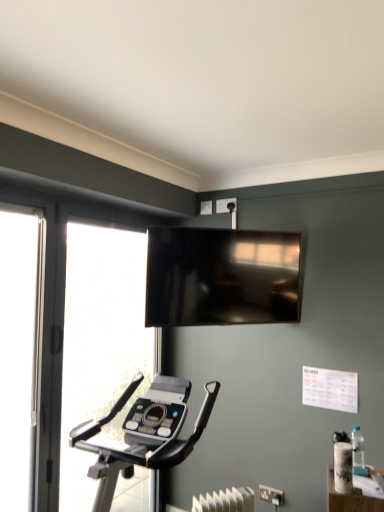
Find the location of `transparent glass window at left`. transparent glass window at left is located at coordinates 100,345.

Measure the distance between white plastic electric outlet at upper center, which is the 2th electric outlet from right to left, and camera.

white plastic electric outlet at upper center, which is the 2th electric outlet from right to left, and camera are 2.74 meters apart.

How much space does white plastic electric outlet at upper center, which appears as the 1th electric outlet when viewed from the top, occupy horizontally?

It is 5.09 centimeters.

Locate an element on the screen. This screenshot has height=512, width=384. white plastic electric outlet at center, acting as the first electric outlet starting from the bottom is located at coordinates (271, 495).

What is the approximate height of matte black tv at upper center?

It is 25.56 inches.

I want to click on transparent glass window at left, so click(x=100, y=345).

Would you say transparent glass window at left is part of matte black tv at upper center's contents?

No.

Is there a large distance between matte black tv at upper center and transparent glass window at left?

No, matte black tv at upper center is not far from transparent glass window at left.

The image size is (384, 512). Find the location of `window in front of the matte black tv at upper center`. window in front of the matte black tv at upper center is located at coordinates (100, 345).

From a real-world perspective, relative to transparent glass window at left, is matte black tv at upper center vertically above or below?

In terms of real-world spatial position, matte black tv at upper center is above transparent glass window at left.

Could you tell me if white plastic electric outlet at center, the second electric outlet viewed from the back, is turned towards white plastic electric outlet at upper center, which appears as the 2th electric outlet when viewed from the front?

No, white plastic electric outlet at center, the second electric outlet viewed from the back, is not facing towards white plastic electric outlet at upper center, which appears as the 2th electric outlet when viewed from the front.

Which object is more forward, white plastic electric outlet at center, the second electric outlet viewed from the back, or white plastic electric outlet at upper center, which appears as the 2th electric outlet when viewed from the front?

Positioned in front is white plastic electric outlet at center, the second electric outlet viewed from the back.

Are white plastic electric outlet at center, which is counted as the second electric outlet, starting from the left, and white plastic electric outlet at upper center, the first electric outlet from the left, beside each other?

No, white plastic electric outlet at center, which is counted as the second electric outlet, starting from the left, is not in contact with white plastic electric outlet at upper center, the first electric outlet from the left.

From the image's perspective, which is below, white plastic electric outlet at center, the first electric outlet positioned from the right, or white plastic electric outlet at upper center, which appears as the 1th electric outlet when viewed from the top?

white plastic electric outlet at center, the first electric outlet positioned from the right, appears lower in the image.

What's the angular difference between transparent glass window at left and matte black tv at upper center's facing directions?

The facing directions of transparent glass window at left and matte black tv at upper center are 41.1 degrees apart.

In the scene shown: From a real-world perspective, which object stands above the other?

In real-world perspective, matte black tv at upper center is above.

Is matte black tv at upper center a part of transparent glass window at left?

No, matte black tv at upper center is located outside of transparent glass window at left.

Which object is wider, matte black tv at upper center or white plastic electric outlet at center, the 2th electric outlet positioned from the top?

Wider between the two is matte black tv at upper center.

Find the location of a particular element. electric outlet lying below the matte black tv at upper center (from the image's perspective) is located at coordinates (271, 495).

Is matte black tv at upper center in contact with white plastic electric outlet at center, the second electric outlet viewed from the back?

No, matte black tv at upper center is not beside white plastic electric outlet at center, the second electric outlet viewed from the back.

From the image's perspective, between matte black tv at upper center and white plastic electric outlet at center, the first electric outlet positioned from the right, who is located below?

white plastic electric outlet at center, the first electric outlet positioned from the right, from the image's perspective.

How many degrees apart are the facing directions of white plastic electric outlet at upper center, positioned as the 1th electric outlet in back-to-front order, and transparent glass screen door at left?

90 degrees.

Is white plastic electric outlet at upper center, positioned as the 1th electric outlet in back-to-front order, further to camera compared to transparent glass screen door at left?

Yes, white plastic electric outlet at upper center, positioned as the 1th electric outlet in back-to-front order, is further from the viewer.

Is white plastic electric outlet at upper center, which appears as the 1th electric outlet when viewed from the top, smaller than transparent glass screen door at left?

Yes.

Is white plastic electric outlet at upper center, the first electric outlet from the left, directly adjacent to transparent glass screen door at left?

They are not placed beside each other.

Can you confirm if white plastic electric outlet at center, the first electric outlet positioned from the right, is thinner than matte black tv at upper center?

Indeed, white plastic electric outlet at center, the first electric outlet positioned from the right, has a lesser width compared to matte black tv at upper center.

Considering the relative sizes of white plastic electric outlet at center, the second electric outlet viewed from the back, and matte black tv at upper center in the image provided, is white plastic electric outlet at center, the second electric outlet viewed from the back, shorter than matte black tv at upper center?

Yes, white plastic electric outlet at center, the second electric outlet viewed from the back, is shorter than matte black tv at upper center.

Is white plastic electric outlet at center, acting as the first electric outlet starting from the bottom, bigger or smaller than matte black tv at upper center?

In the image, white plastic electric outlet at center, acting as the first electric outlet starting from the bottom, appears to be smaller than matte black tv at upper center.

From the image's perspective, relative to matte black tv at upper center, is white plastic electric outlet at center, the first electric outlet positioned from the right, above or below?

From the image's perspective, white plastic electric outlet at center, the first electric outlet positioned from the right, appears below matte black tv at upper center.

From the picture: Which of these two, transparent glass window at left or white plastic electric outlet at upper center, marked as the second electric outlet in a bottom-to-top arrangement, is thinner?

white plastic electric outlet at upper center, marked as the second electric outlet in a bottom-to-top arrangement, is thinner.

Is transparent glass window at left aimed at white plastic electric outlet at upper center, which is the 2th electric outlet from right to left?

Yes, transparent glass window at left is facing white plastic electric outlet at upper center, which is the 2th electric outlet from right to left.

From the image's perspective, is transparent glass window at left above or below white plastic electric outlet at upper center, which appears as the 1th electric outlet when viewed from the top?

transparent glass window at left is below white plastic electric outlet at upper center, which appears as the 1th electric outlet when viewed from the top.

Does transparent glass window at left have a smaller size compared to white plastic electric outlet at upper center, positioned as the 1th electric outlet in back-to-front order?

No.

Where is `television above the transparent glass window at left (from a real-world perspective)`? This screenshot has width=384, height=512. television above the transparent glass window at left (from a real-world perspective) is located at coordinates pyautogui.click(x=221, y=277).

This screenshot has height=512, width=384. In order to click on electric outlet lying on the right of white plastic electric outlet at upper center, marked as the second electric outlet in a bottom-to-top arrangement in this screenshot , I will do 271,495.

When comparing their distances from white plastic electric outlet at center, the 2th electric outlet positioned from the top, does matte black tv at upper center or transparent glass window at left seem closer?

matte black tv at upper center lies closer to white plastic electric outlet at center, the 2th electric outlet positioned from the top, than the other object.

Looking at the image, which one is located further to matte black tv at upper center, transparent glass window at left or transparent glass screen door at left?

transparent glass screen door at left.

Considering their positions, is white plastic electric outlet at upper center, which appears as the 1th electric outlet when viewed from the top, positioned closer to transparent glass window at left than matte black tv at upper center?

The object closer to transparent glass window at left is matte black tv at upper center.

Considering their positions, is matte black tv at upper center positioned closer to transparent glass screen door at left than white plastic electric outlet at upper center, which appears as the 2th electric outlet when viewed from the front?

The object closer to transparent glass screen door at left is matte black tv at upper center.

When comparing their distances from white plastic electric outlet at upper center, which appears as the 2th electric outlet when viewed from the front, does transparent glass window at left or matte black tv at upper center seem further?

Among the two, transparent glass window at left is located further to white plastic electric outlet at upper center, which appears as the 2th electric outlet when viewed from the front.

Based on their spatial positions, is transparent glass screen door at left or white plastic electric outlet at upper center, which is the 2th electric outlet from right to left, closer to white plastic electric outlet at center, the first electric outlet positioned from the right?

transparent glass screen door at left.

From the image, which object appears to be nearer to matte black tv at upper center, transparent glass screen door at left or white plastic electric outlet at center, the second electric outlet viewed from the back?

transparent glass screen door at left.

When comparing their distances from matte black tv at upper center, does white plastic electric outlet at center, the 1th electric outlet from the front, or transparent glass screen door at left seem closer?

Among the two, transparent glass screen door at left is located nearer to matte black tv at upper center.

Where is `screen door between white plastic electric outlet at upper center, marked as the second electric outlet in a bottom-to-top arrangement, and transparent glass window at left vertically`? The height and width of the screenshot is (512, 384). screen door between white plastic electric outlet at upper center, marked as the second electric outlet in a bottom-to-top arrangement, and transparent glass window at left vertically is located at coordinates (20, 354).

Where is `television between white plastic electric outlet at upper center, the first electric outlet from the left, and white plastic electric outlet at center, the 2th electric outlet positioned from the top, vertically`? television between white plastic electric outlet at upper center, the first electric outlet from the left, and white plastic electric outlet at center, the 2th electric outlet positioned from the top, vertically is located at coordinates (221, 277).

Where is `television between white plastic electric outlet at upper center, which appears as the 1th electric outlet when viewed from the top, and transparent glass window at left from top to bottom`? television between white plastic electric outlet at upper center, which appears as the 1th electric outlet when viewed from the top, and transparent glass window at left from top to bottom is located at coordinates (221, 277).

The height and width of the screenshot is (512, 384). I want to click on window that lies between white plastic electric outlet at upper center, marked as the second electric outlet in a bottom-to-top arrangement, and white plastic electric outlet at center, the first electric outlet positioned from the right, from top to bottom, so click(x=100, y=345).